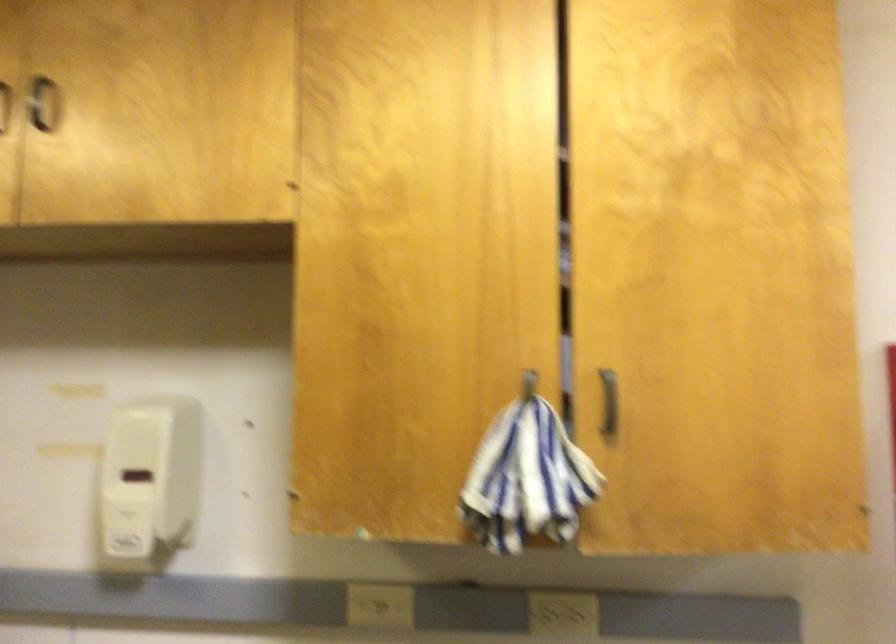
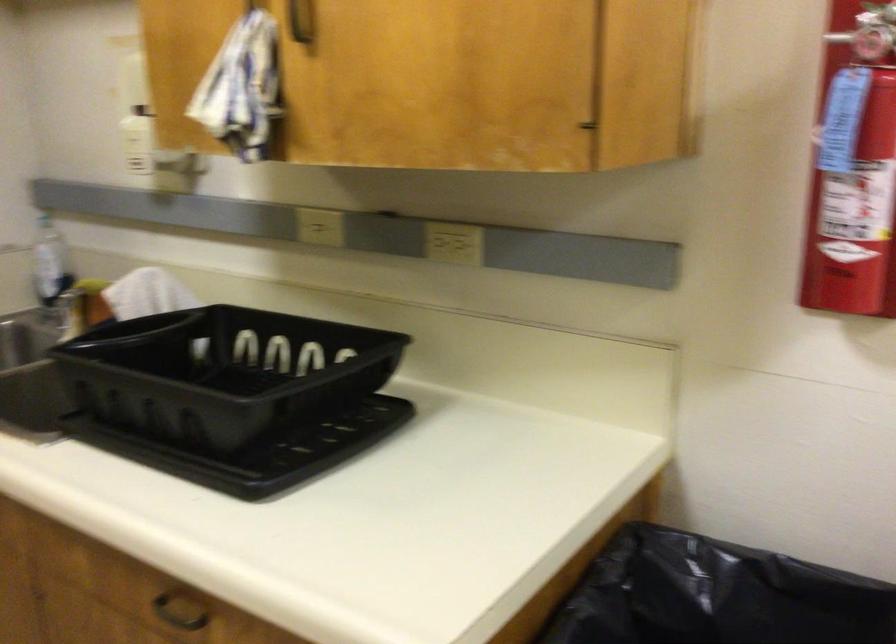
Where in the second image is the point corresponding to the point at 596,424 from the first image?

(299, 21)